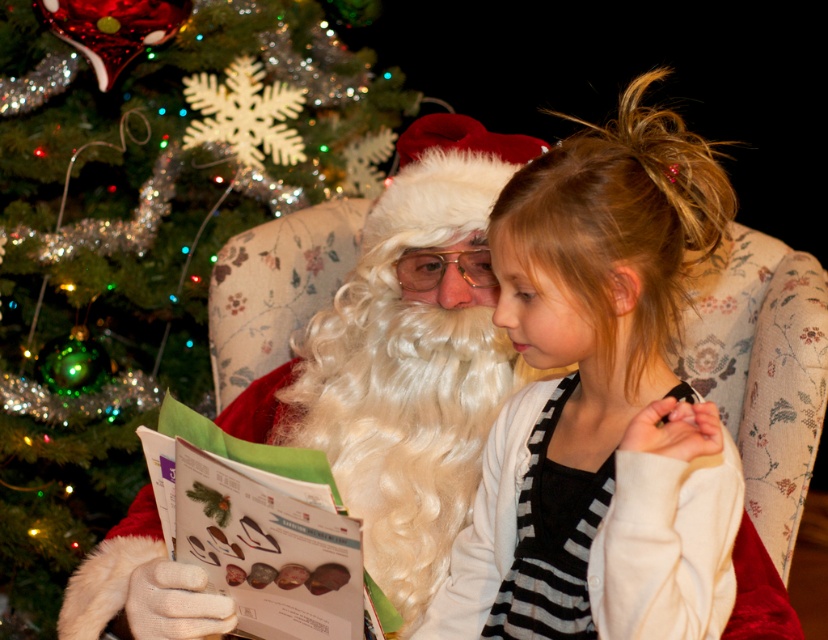
You are standing in the room where the Christmas tree is located. You see the point marked at coordinate (x=138, y=236). What object is located at that point?

The point at coordinate (x=138, y=236) marks the green glittery Christmas tree at left.

You are standing at point (218, 42) and want to walk to point (657, 563). Is the path between them clear? Please explain using the scene description.

The path between point (218, 42) and point (657, 563) is clear because there are no objects blocking the way between them.